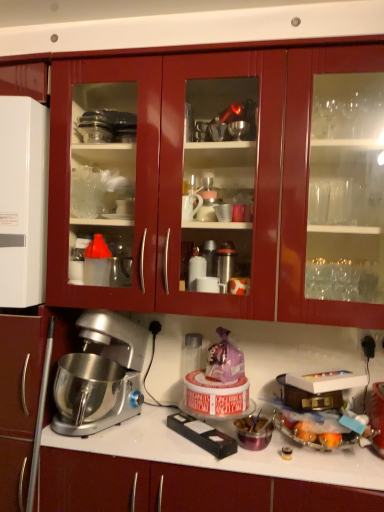
Question: Are translucent plastic container at lower right, the second appliance in the top-to-bottom sequence, and satin silver countertop at center located far from each other?

Choices:
 (A) no
 (B) yes

Answer: (A)

Question: From the image's perspective, is translucent plastic container at lower right, the second appliance in the top-to-bottom sequence, above satin silver countertop at center?

Choices:
 (A) no
 (B) yes

Answer: (B)

Question: Considering the relative positions of translucent plastic container at lower right, the second appliance in the top-to-bottom sequence, and satin silver countertop at center in the image provided, is translucent plastic container at lower right, the second appliance in the top-to-bottom sequence, to the left of satin silver countertop at center from the viewer's perspective?

Choices:
 (A) no
 (B) yes

Answer: (A)

Question: Considering the relative sizes of translucent plastic container at lower right, the first appliance in the right-to-left sequence, and satin silver countertop at center in the image provided, is translucent plastic container at lower right, the first appliance in the right-to-left sequence, taller than satin silver countertop at center?

Choices:
 (A) no
 (B) yes

Answer: (A)

Question: From the image's perspective, would you say translucent plastic container at lower right, the 1th appliance positioned from the bottom, is shown under satin silver countertop at center?

Choices:
 (A) no
 (B) yes

Answer: (A)

Question: Is translucent plastic container at lower right, the 1th appliance positioned from the bottom, smaller than satin silver countertop at center?

Choices:
 (A) no
 (B) yes

Answer: (B)

Question: Is satin silver countertop at center further to camera compared to glossy wood cabinets at upper center?

Choices:
 (A) yes
 (B) no

Answer: (B)

Question: Can you confirm if satin silver countertop at center is thinner than glossy wood cabinets at upper center?

Choices:
 (A) yes
 (B) no

Answer: (B)

Question: Is glossy wood cabinets at upper center inside satin silver countertop at center?

Choices:
 (A) no
 (B) yes

Answer: (A)

Question: Considering the relative sizes of satin silver countertop at center and glossy wood cabinets at upper center in the image provided, is satin silver countertop at center wider than glossy wood cabinets at upper center?

Choices:
 (A) no
 (B) yes

Answer: (B)

Question: Does satin silver countertop at center have a smaller size compared to glossy wood cabinets at upper center?

Choices:
 (A) no
 (B) yes

Answer: (B)

Question: Is satin silver countertop at center next to glossy wood cabinets at upper center and touching it?

Choices:
 (A) yes
 (B) no

Answer: (B)

Question: From the image's perspective, is white glossy refrigerator at left, which appears as the 1th appliance when viewed from the left, on top of satin silver countertop at center?

Choices:
 (A) yes
 (B) no

Answer: (A)